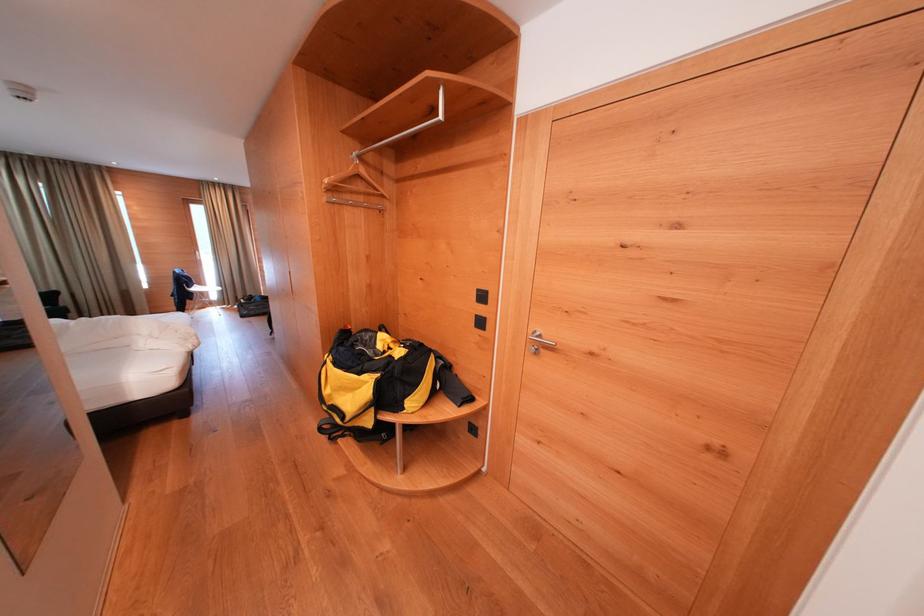
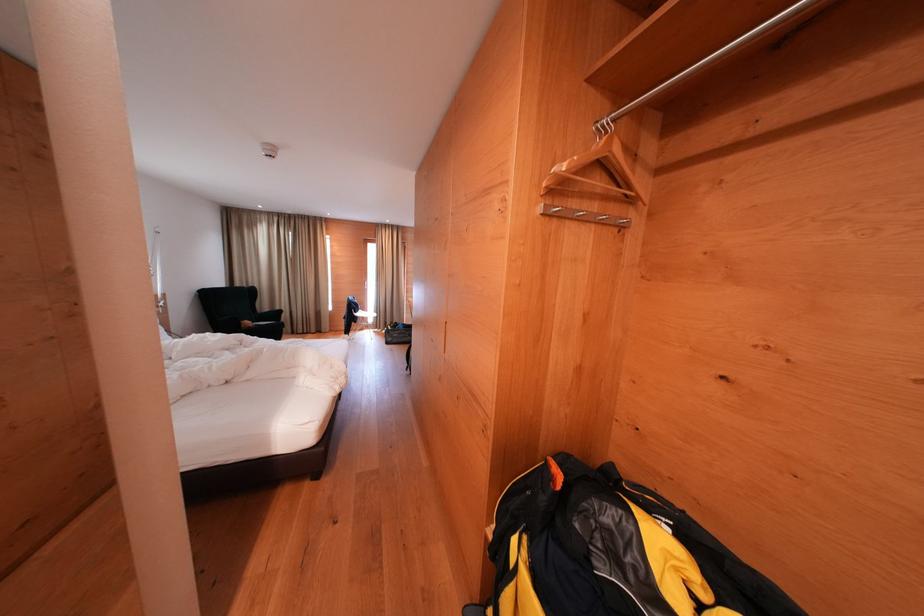
Locate, in the second image, the point that corresponds to [371,351] in the first image.

(635, 584)